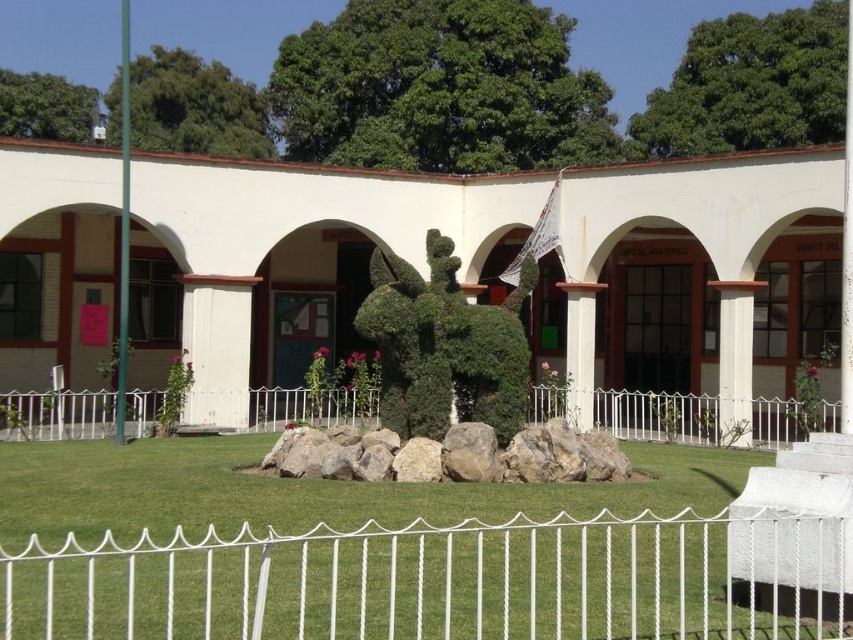
Question: Does white metal fence at center appear on the right side of gray rock at center?

Choices:
 (A) no
 (B) yes

Answer: (A)

Question: Among these points, which one is farthest from the camera?

Choices:
 (A) (459, 426)
 (B) (479, 328)

Answer: (B)

Question: Is white wire fence at lower center smaller than white metal fence at center?

Choices:
 (A) yes
 (B) no

Answer: (A)

Question: Based on their relative distances, which object is farther from the green leafy hedge at center?

Choices:
 (A) white wire fence at lower center
 (B) white metal fence at center

Answer: (B)

Question: Which object is farther from the camera taking this photo?

Choices:
 (A) gray rock at center
 (B) white metal fence at center

Answer: (B)

Question: Is white metal fence at center wider than green leafy hedge at center?

Choices:
 (A) no
 (B) yes

Answer: (B)